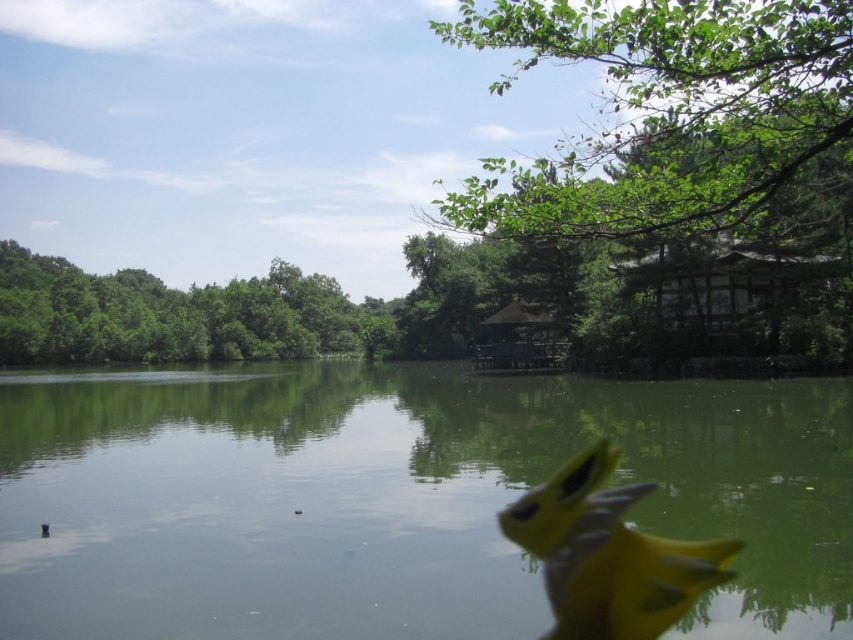
Between green leafy tree at upper right and green leafy trees at upper left, which one is positioned lower?

green leafy trees at upper left is below.

Is green leafy tree at upper right shorter than green leafy trees at upper left?

No.

Between point (689, 172) and point (285, 330), which one is positioned behind?

The point (285, 330) is behind.

Find the location of a particular element. The image size is (853, 640). green leafy tree at upper right is located at coordinates (664, 112).

Who is higher up, green leafy trees at upper left or yellow matte bird at center?

Positioned higher is green leafy trees at upper left.

Measure the distance between point (329, 291) and camera.

Point (329, 291) is 518.35 feet from camera.

Where is `green leafy trees at upper left`? green leafy trees at upper left is located at coordinates [171, 316].

In order to click on green leafy trees at upper left in this screenshot , I will do `click(171, 316)`.

Can you confirm if green smooth water at center is positioned above green leafy tree at upper right?

Incorrect, green smooth water at center is not positioned above green leafy tree at upper right.

This screenshot has width=853, height=640. What do you see at coordinates (395, 499) in the screenshot?
I see `green smooth water at center` at bounding box center [395, 499].

What do you see at coordinates (395, 499) in the screenshot?
I see `green smooth water at center` at bounding box center [395, 499].

Where is `green smooth water at center`? Image resolution: width=853 pixels, height=640 pixels. green smooth water at center is located at coordinates (395, 499).